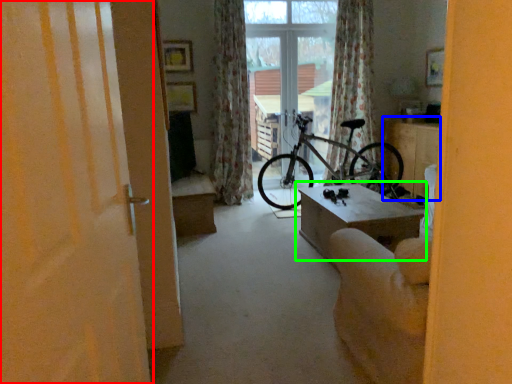
Question: Which object is positioned farthest from door (highlighted by a red box)? Select from table (highlighted by a blue box) and table (highlighted by a green box).

Choices:
 (A) table
 (B) table

Answer: (A)